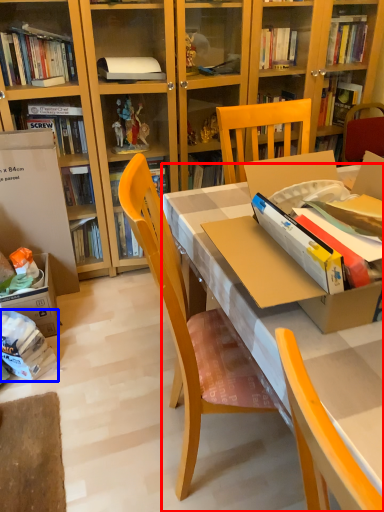
Question: Among these objects, which one is farthest to the camera, desk (highlighted by a red box) or book (highlighted by a blue box)?

Choices:
 (A) desk
 (B) book

Answer: (B)